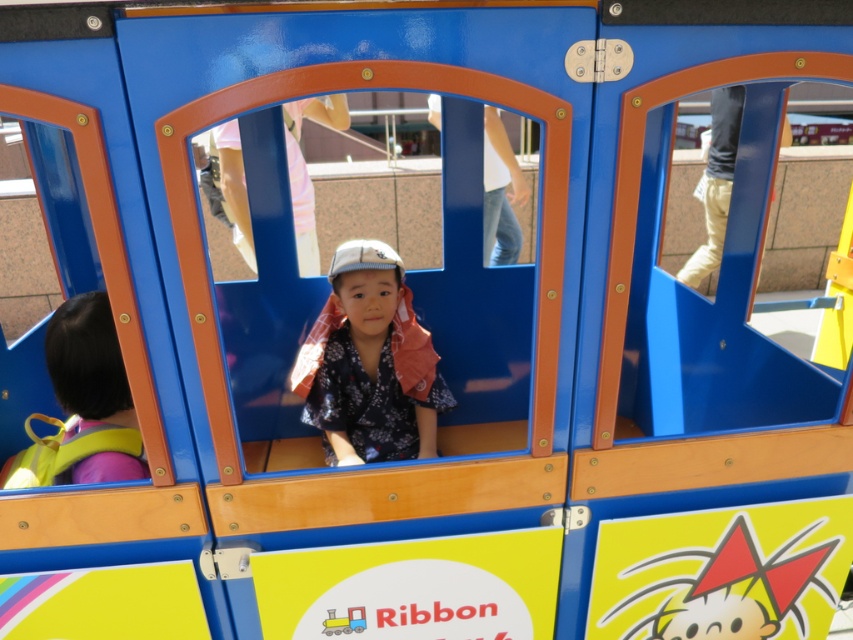
Question: Which object appears closest to the camera in this image?

Choices:
 (A) floral fabric kimono at center
 (B) yellow fabric backpack at left

Answer: (B)

Question: Where is floral fabric kimono at center located in relation to yellow fabric backpack at left in the image?

Choices:
 (A) right
 (B) left

Answer: (A)

Question: Which point is farther to the camera?

Choices:
 (A) yellow fabric backpack at left
 (B) floral fabric kimono at center

Answer: (B)

Question: Is floral fabric kimono at center positioned behind yellow fabric backpack at left?

Choices:
 (A) no
 (B) yes

Answer: (B)

Question: Is floral fabric kimono at center closer to the viewer compared to yellow fabric backpack at left?

Choices:
 (A) no
 (B) yes

Answer: (A)